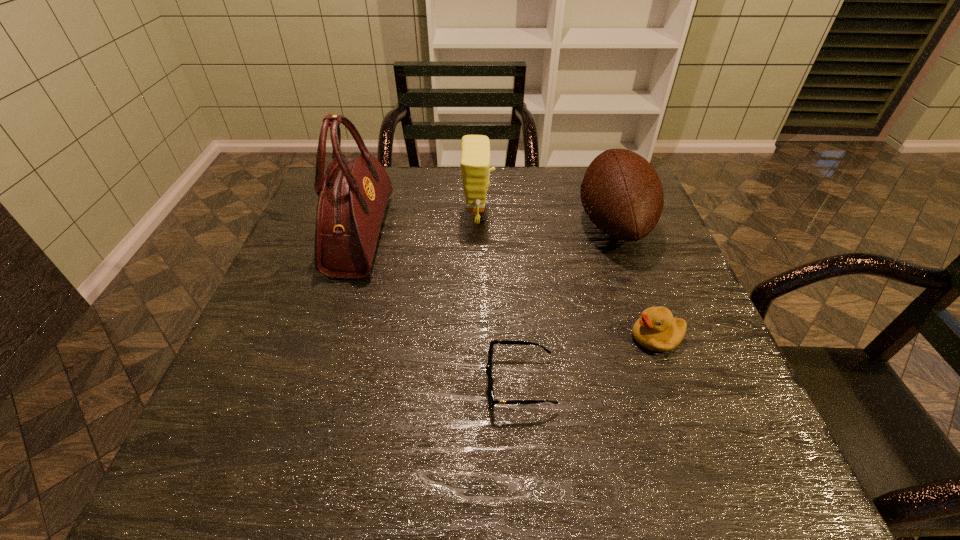
Image resolution: width=960 pixels, height=540 pixels. Identify the location of the leftmost object. (353, 195).

I want to click on handbag, so click(353, 195).

You are a GUI agent. You are given a task and a screenshot of the screen. Output one action in this format:
    pyautogui.click(x=<x>, y=<y>)
    Task: Click on the sponge
    This screenshot has width=960, height=540.
    Given the screenshot: What is the action you would take?
    pyautogui.click(x=475, y=149)

At what (x,y) coordinates should I click in order to perform the action: click on football. Please return your answer as a coordinate pair (x, y). Looking at the image, I should click on (622, 194).

Identify the location of the fourth tallest object. (656, 330).

Image resolution: width=960 pixels, height=540 pixels. In order to click on sunglasses in this screenshot , I will do `click(492, 401)`.

Identify the location of free location located 0.320m on the front-facing side of the tallest object. Image resolution: width=960 pixels, height=540 pixels. (509, 235).

The width and height of the screenshot is (960, 540). What are the coordinates of `vacant space located 0.180m on the face of the sponge` in the screenshot? It's located at (x=560, y=217).

This screenshot has height=540, width=960. In order to click on free region located on the laces of the football in this screenshot , I will do `click(440, 224)`.

Where is `vacant area located 0.050m on the laces of the football`? Image resolution: width=960 pixels, height=540 pixels. vacant area located 0.050m on the laces of the football is located at coordinates (559, 224).